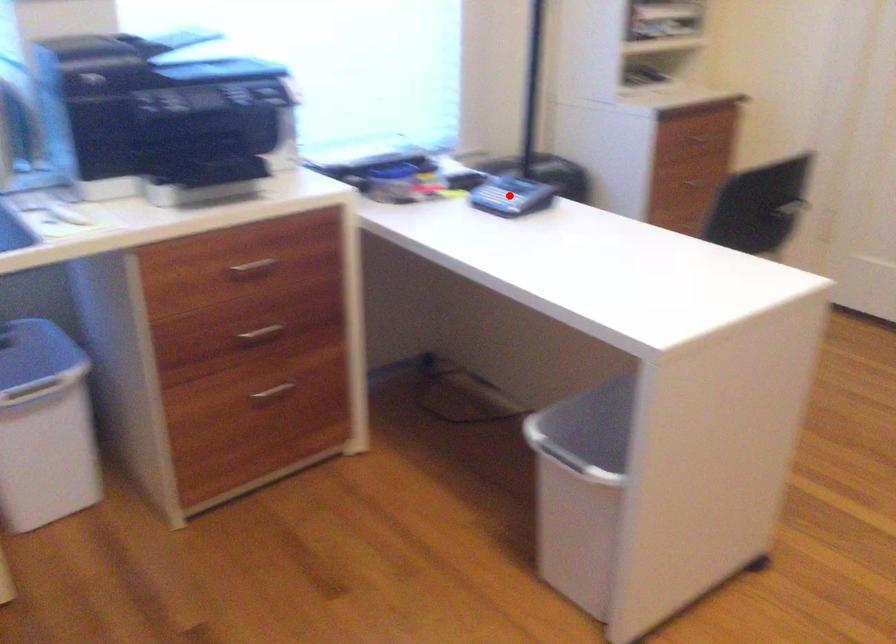
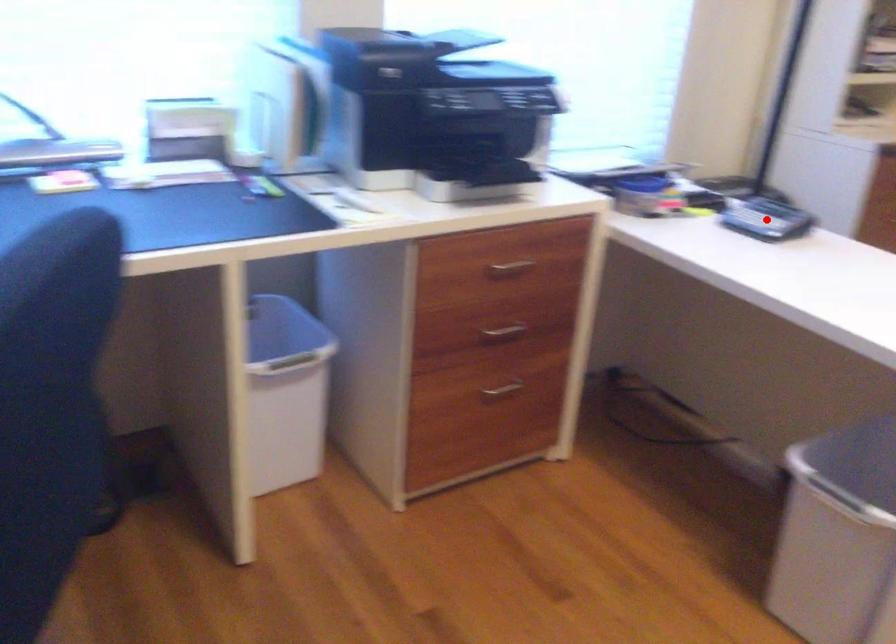
I am providing you with two images of the same scene from different viewpoints. A red point is marked on the first image and another point is marked on the second image. Is the red point in image1 aligned with the point shown in image2?

Yes